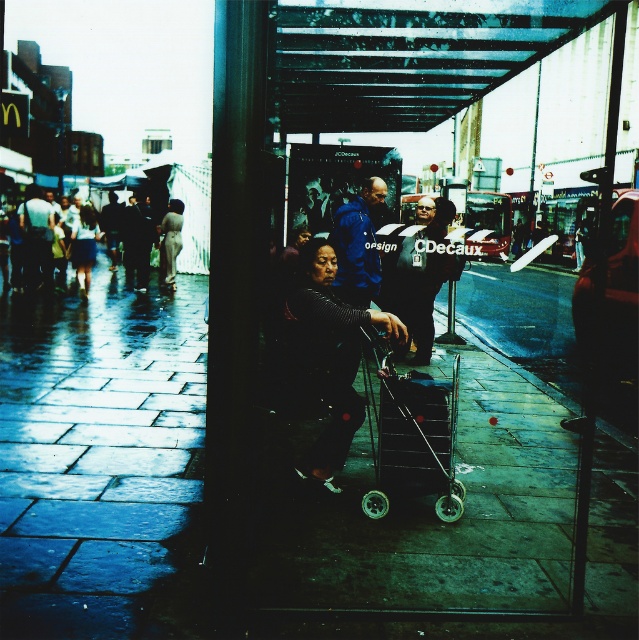
Question: Which object is closer to the camera taking this photo?

Choices:
 (A) dark gray stone pavement at center
 (B) metallic silver trolley at center
 (C) dark gray fabric umbrella at center

Answer: (A)

Question: Which point is farther to the camera?

Choices:
 (A) dark gray fabric umbrella at center
 (B) dark gray fabric jacket at center

Answer: (A)

Question: Can you confirm if dark gray fabric jacket at center is smaller than dark blue jacket at left?

Choices:
 (A) no
 (B) yes

Answer: (A)

Question: Does metallic silver cart at center appear on the left side of blue fabric jacket at center?

Choices:
 (A) yes
 (B) no

Answer: (A)

Question: Does metallic silver cart at center have a smaller size compared to blue fabric jacket at center?

Choices:
 (A) no
 (B) yes

Answer: (B)

Question: Which point appears closest to the camera in this image?

Choices:
 (A) coord(245,81)
 (B) coord(355,502)
 (C) coord(312,266)
 (D) coord(31,282)

Answer: (A)